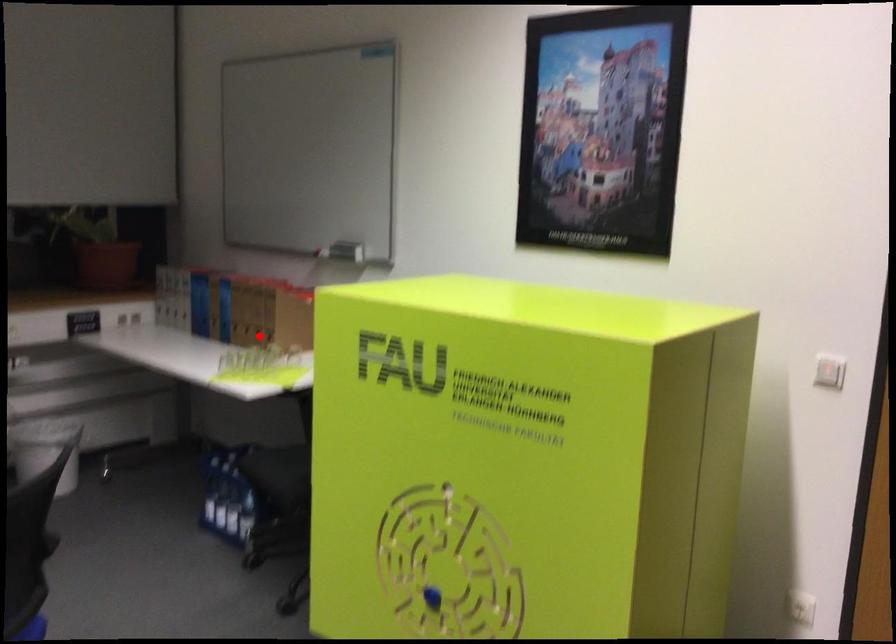
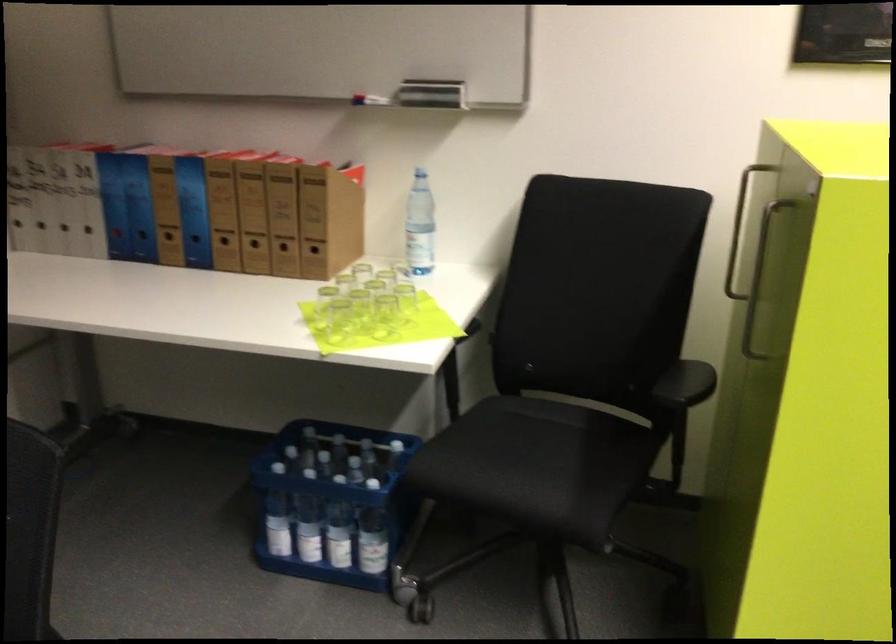
In the second image, find the point that corresponds to the highlighted location in the first image.

(283, 252)